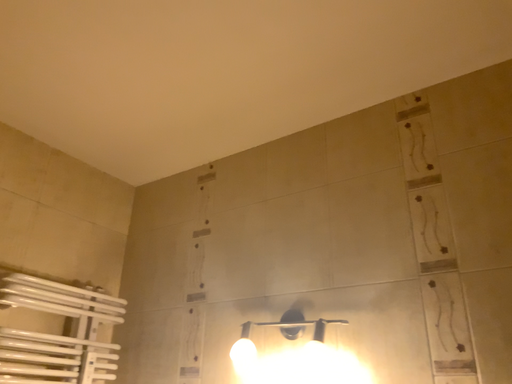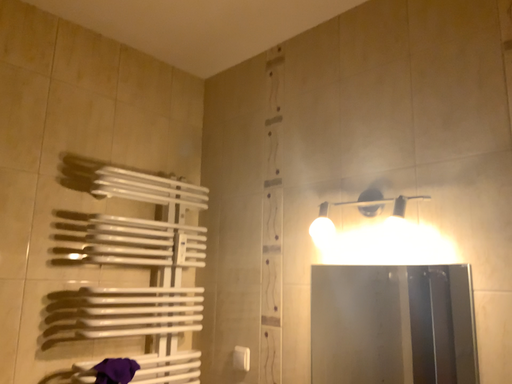
Question: How did the camera likely rotate when shooting the video?

Choices:
 (A) rotated upward
 (B) rotated downward

Answer: (B)